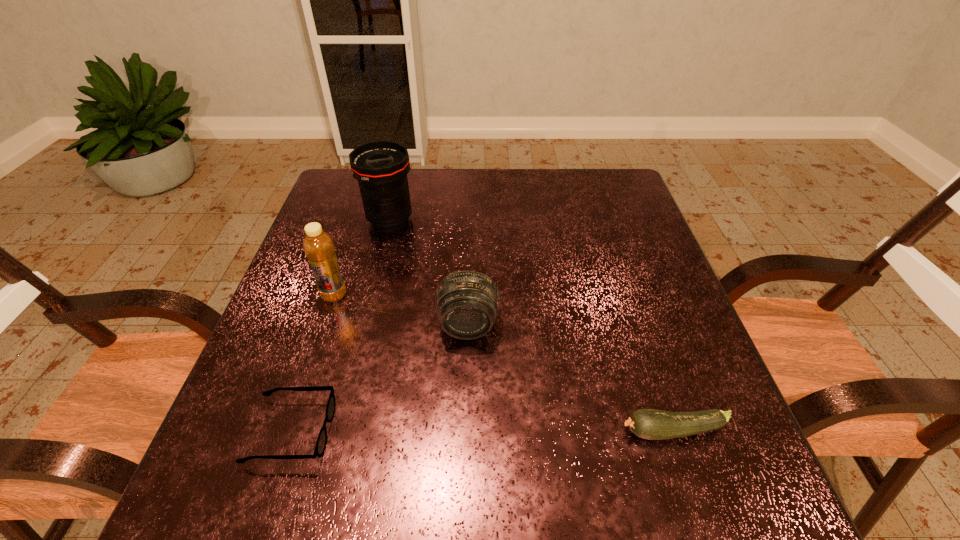
Where is `the farthest object`? The height and width of the screenshot is (540, 960). the farthest object is located at coordinates (381, 167).

You are a GUI agent. You are given a task and a screenshot of the screen. Output one action in this format:
    pyautogui.click(x=<x>, y=<y>)
    Task: Click on the taller telephoto lens
    The width and height of the screenshot is (960, 540).
    Given the screenshot: What is the action you would take?
    pyautogui.click(x=381, y=167)

The width and height of the screenshot is (960, 540). I want to click on the second farthest object, so click(318, 246).

The height and width of the screenshot is (540, 960). I want to click on the fourth object from left to right, so click(467, 302).

Where is `the third nearest object`? the third nearest object is located at coordinates [467, 302].

This screenshot has width=960, height=540. I want to click on zucchini, so click(x=648, y=424).

Locate an element on the screen. spectacles is located at coordinates (320, 447).

Identify the location of vacant space situated 0.080m on the right of the farther telephoto lens. The image size is (960, 540). (445, 220).

Find the location of a particular element. The width and height of the screenshot is (960, 540). free space located 0.140m on the front of the fourth nearest object is located at coordinates (314, 356).

In order to click on blank space located 0.100m at the front element of the third shortest object in this screenshot , I will do `click(467, 386)`.